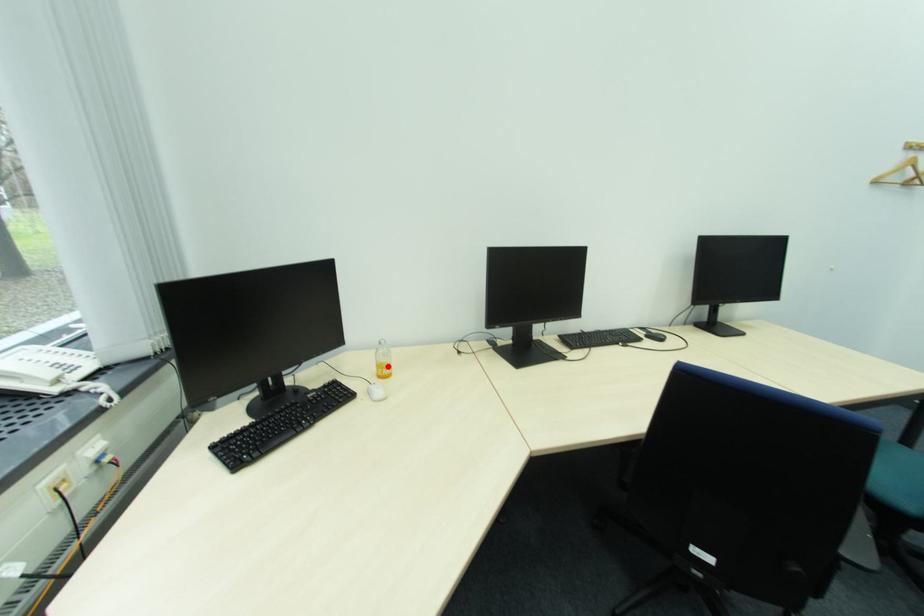
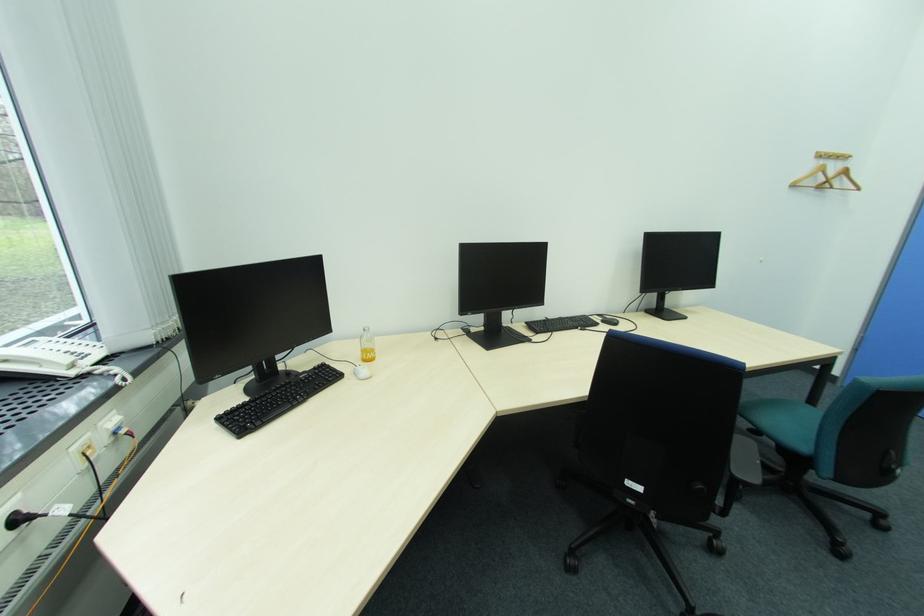
In the second image, find the point that corresponds to the highlighted location in the first image.

(371, 352)